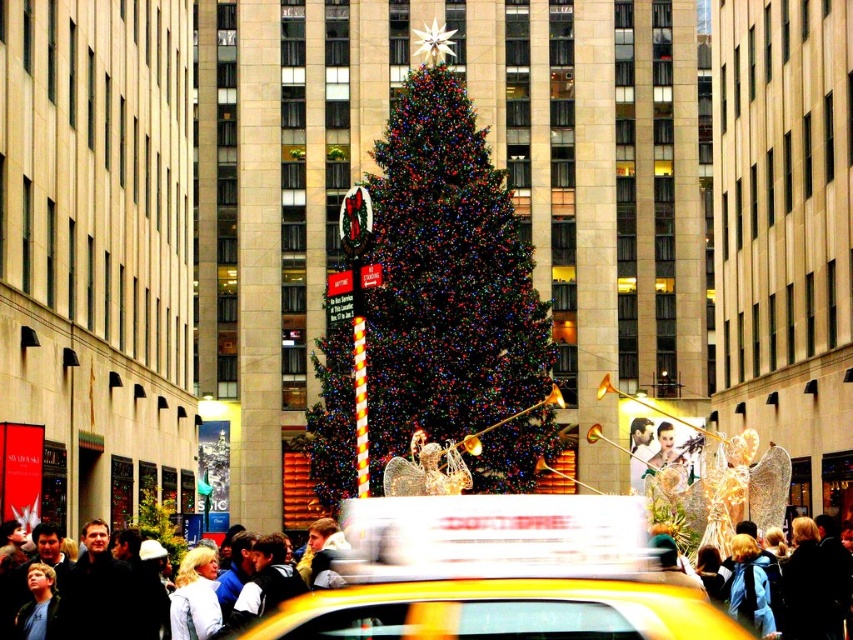
You are standing at the base of the Christmas tree and want to take a photo of the golden angelic figures holding trumpets. There are two points marked in the image. The first point is at coordinates point (514, 552) and the second point is at coordinates point (123, 611). Which point should you stand at to ensure the golden angelic figures are in the foreground of your photo?

You should stand at point (514, 552) because it is in front of point (123, 611), making it closer to the golden angelic figures holding trumpets for a better foreground view.

You are a delivery person trying to navigate through the busy street. There is a green matte christmas tree at center and a yellow plastic taxi at center. Which object is wider, allowing you more space to pass around it?

The green matte christmas tree at center might be wider than yellow plastic taxi at center, so you should go around the green matte christmas tree at center to have more space.

You are standing in the middle of the street looking at the Christmas tree. There are two points marked in the scene. One is at coordinates point (x=422, y=316) and the other is at point (x=576, y=611). Which point is closer to you?

Point (x=422, y=316) is closer to you because it is further to the viewer than point (x=576, y=611).